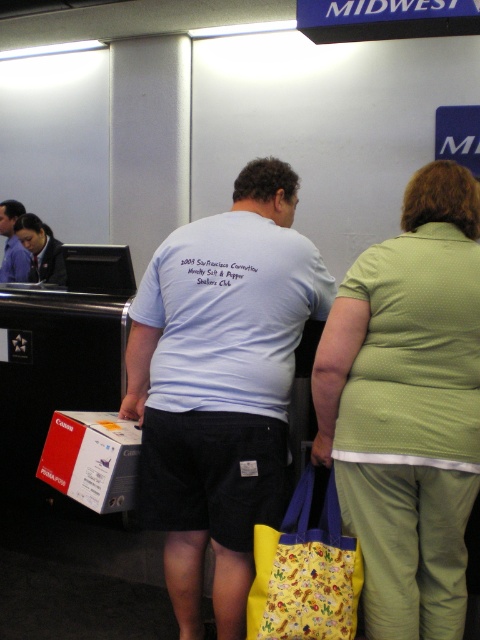
Does green dotted shirt at center have a greater height compared to yellow fabric bag at lower center?

Indeed, green dotted shirt at center has a greater height compared to yellow fabric bag at lower center.

Is point (361, 253) closer to viewer compared to point (287, 541)?

No, it is behind (287, 541).

Image resolution: width=480 pixels, height=640 pixels. What are the coordinates of `green dotted shirt at center` in the screenshot? It's located at (408, 406).

Which is in front, point (312, 621) or point (27, 260)?

Point (312, 621) is more forward.

Can you confirm if yellow fabric bag at lower center is smaller than blue cotton shirt at center?

Yes.

Between point (328, 618) and point (11, 234), which one is positioned behind?

The point (11, 234) is more distant.

Locate an element on the screen. The height and width of the screenshot is (640, 480). yellow fabric bag at lower center is located at coordinates (304, 572).

Does white cotton t-shirt at center come in front of green dotted shirt at center?

No, it is behind green dotted shirt at center.

Does white cotton t-shirt at center have a larger size compared to green dotted shirt at center?

Indeed, white cotton t-shirt at center has a larger size compared to green dotted shirt at center.

The width and height of the screenshot is (480, 640). Identify the location of white cotton t-shirt at center. (220, 385).

The height and width of the screenshot is (640, 480). Find the location of `white cotton t-shirt at center`. white cotton t-shirt at center is located at coordinates (220, 385).